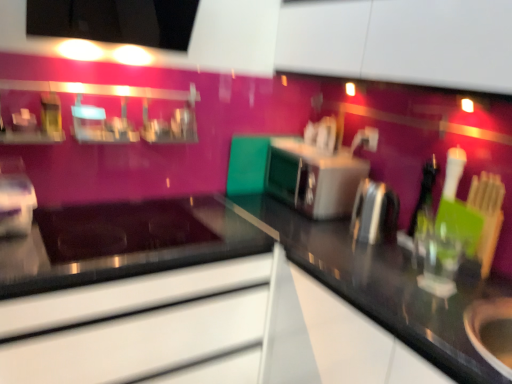
Question: Is satin silver toaster at center, acting as the second appliance starting from the left, at the back of black glossy countertop at center?

Choices:
 (A) no
 (B) yes

Answer: (A)

Question: Does black glossy countertop at center touch satin silver toaster at center, acting as the second appliance starting from the left?

Choices:
 (A) yes
 (B) no

Answer: (B)

Question: Can you confirm if black glossy countertop at center is smaller than satin silver toaster at center, acting as the first appliance starting from the back?

Choices:
 (A) no
 (B) yes

Answer: (A)

Question: From a real-world perspective, is black glossy countertop at center located beneath satin silver toaster at center, acting as the second appliance starting from the left?

Choices:
 (A) yes
 (B) no

Answer: (A)

Question: From the image's perspective, is black glossy countertop at center above satin silver toaster at center, positioned as the 3th appliance in front-to-back order?

Choices:
 (A) yes
 (B) no

Answer: (B)

Question: In terms of width, does metallic silver oven at center look wider or thinner when compared to metallic silver kettle at right, which is the third appliance in left-to-right order?

Choices:
 (A) wide
 (B) thin

Answer: (B)

Question: Considering the positions of metallic silver oven at center and metallic silver kettle at right, the first appliance from the front, in the image, is metallic silver oven at center bigger or smaller than metallic silver kettle at right, the first appliance from the front,?

Choices:
 (A) small
 (B) big

Answer: (B)

Question: From the image's perspective, is metallic silver oven at center above or below metallic silver kettle at right, which is the third appliance in left-to-right order?

Choices:
 (A) above
 (B) below

Answer: (A)

Question: From a real-world perspective, is metallic silver oven at center positioned above or below metallic silver kettle at right, which is the third appliance in left-to-right order?

Choices:
 (A) below
 (B) above

Answer: (B)

Question: From a real-world perspective, is satin silver toaster at center, positioned as the 3th appliance in front-to-back order, physically located above or below metallic silver kettle at right, the first appliance positioned from the right?

Choices:
 (A) below
 (B) above

Answer: (B)

Question: Is satin silver toaster at center, the 2th appliance viewed from the right, in front of or behind metallic silver kettle at right, the first appliance from the front, in the image?

Choices:
 (A) behind
 (B) front

Answer: (A)

Question: From their relative heights in the image, would you say satin silver toaster at center, the 2th appliance viewed from the right, is taller or shorter than metallic silver kettle at right, the first appliance positioned from the right?

Choices:
 (A) tall
 (B) short

Answer: (A)

Question: From the image's perspective, is satin silver toaster at center, acting as the first appliance starting from the back, above or below metallic silver kettle at right, the first appliance positioned from the right?

Choices:
 (A) above
 (B) below

Answer: (A)

Question: Looking at their shapes, would you say metallic silver kettle at right, the first appliance from the front, is wider or thinner than black glossy countertop at center?

Choices:
 (A) wide
 (B) thin

Answer: (B)

Question: Choose the correct answer: Is metallic silver kettle at right, the first appliance from the front, inside black glossy countertop at center or outside it?

Choices:
 (A) inside
 (B) outside

Answer: (A)